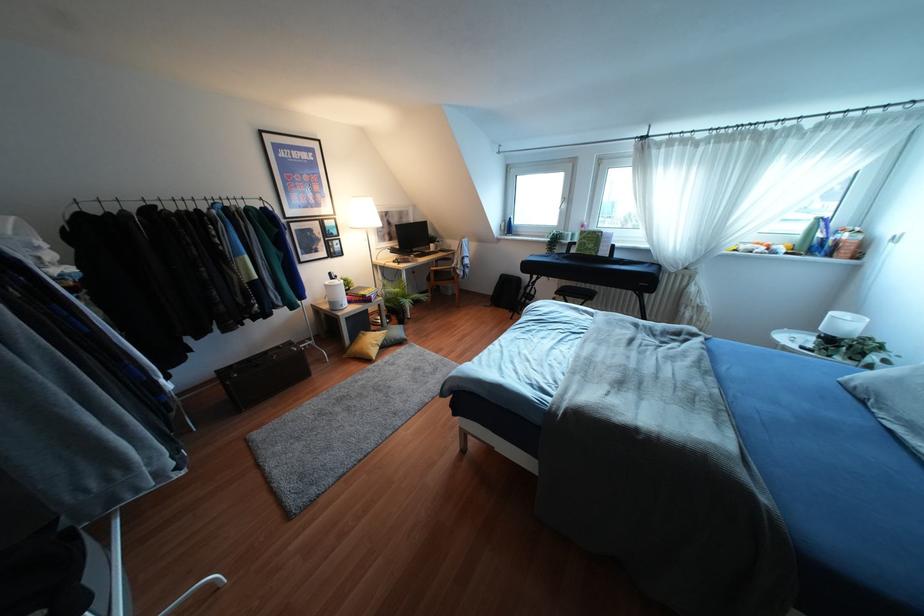
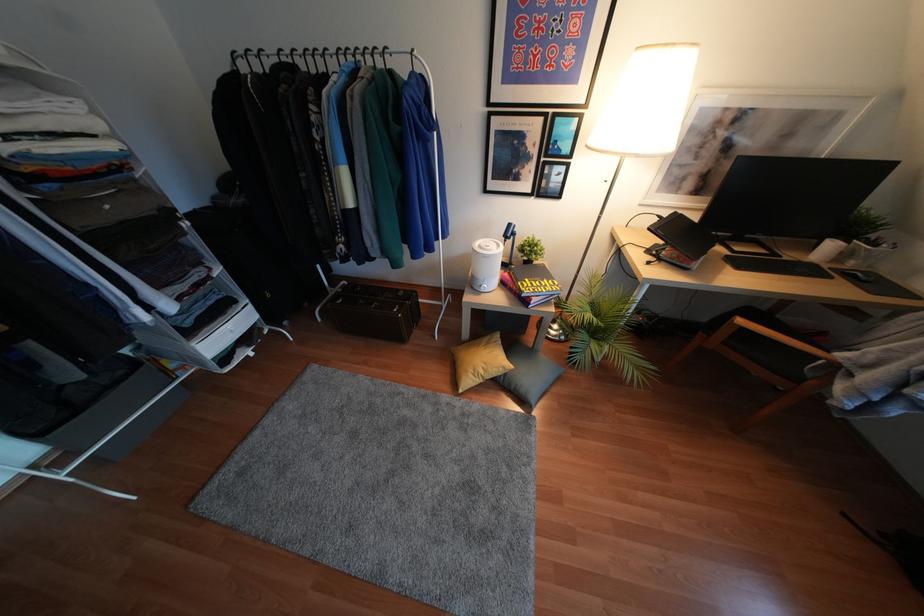
Question: I am providing you with two images of the same scene from different viewpoints. Please identify which objects are invisible in image2.

Choices:
 (A) black computer mouse
 (B) white humidifier
 (C) black drawing tablet
 (D) none of these

Answer: (D)